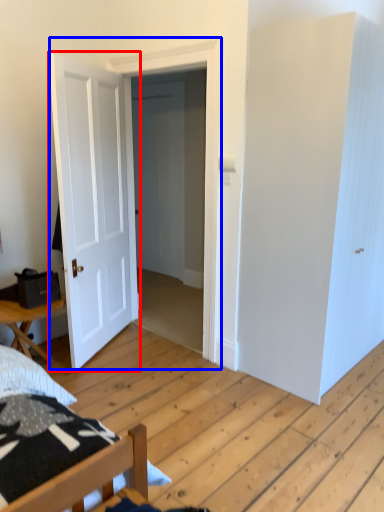
Question: Which of the following is the farthest to the observer, door (highlighted by a red box) or door (highlighted by a blue box)?

Choices:
 (A) door
 (B) door

Answer: (B)